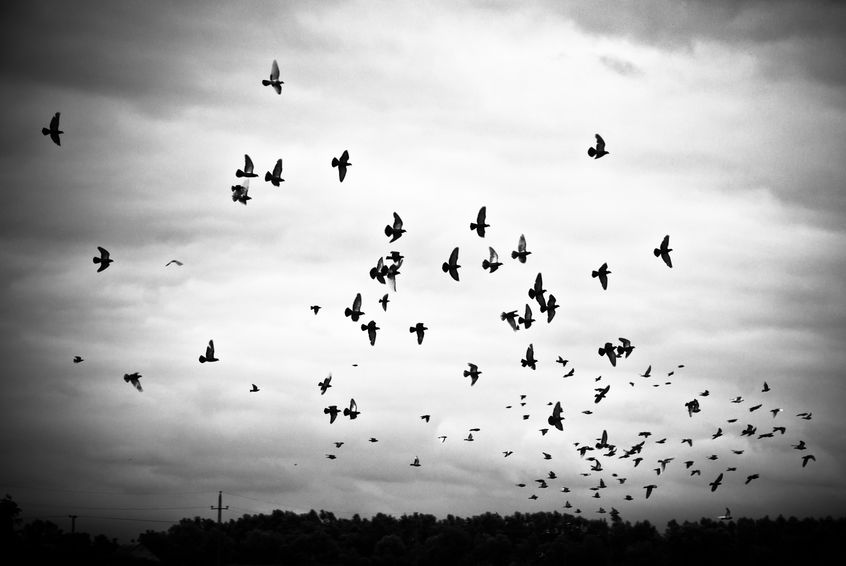
Find the location of a particular element. cable is located at coordinates (198, 507).